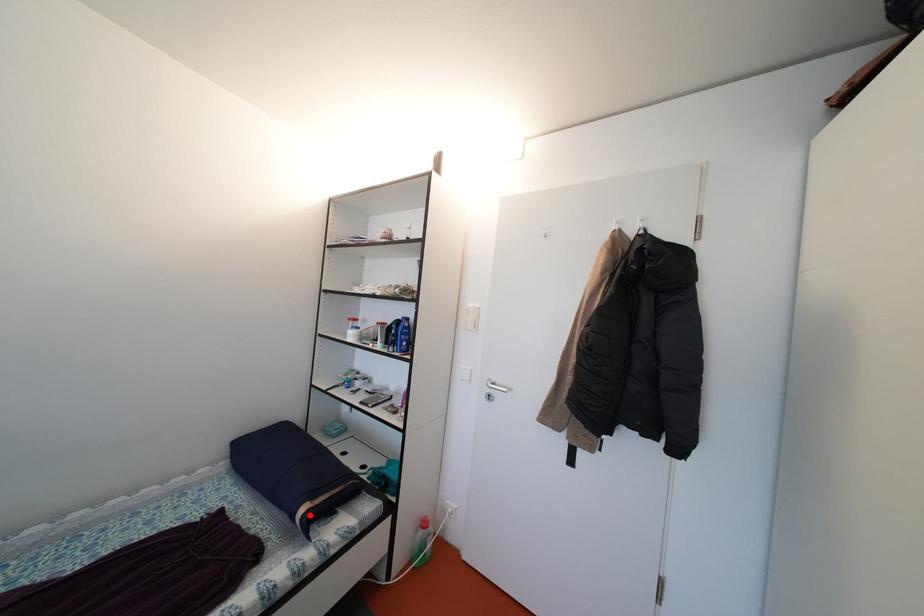
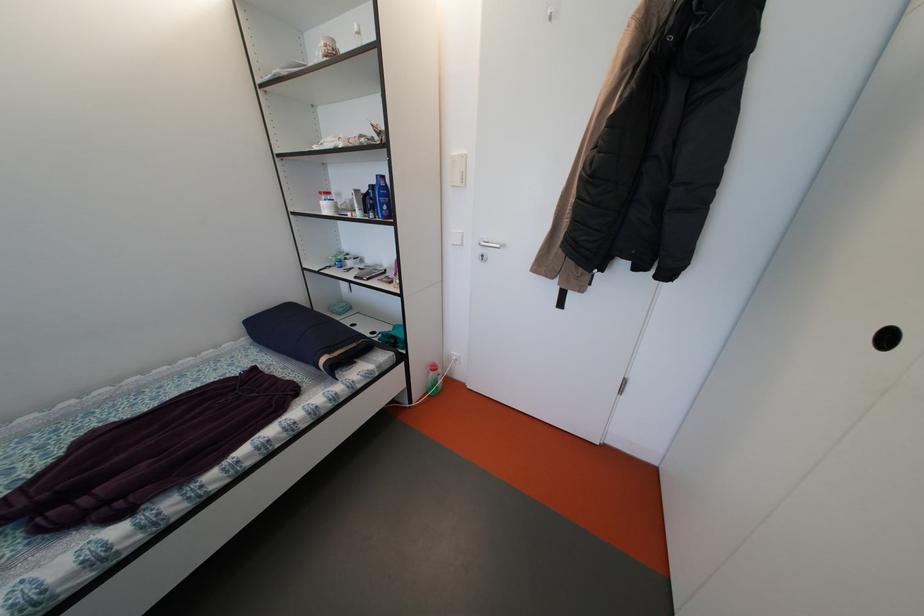
Find the pixel in the second image that matches the highlighted location in the first image.

(331, 365)